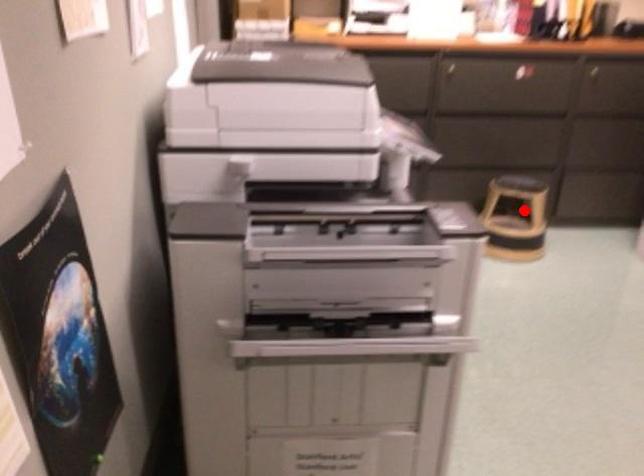
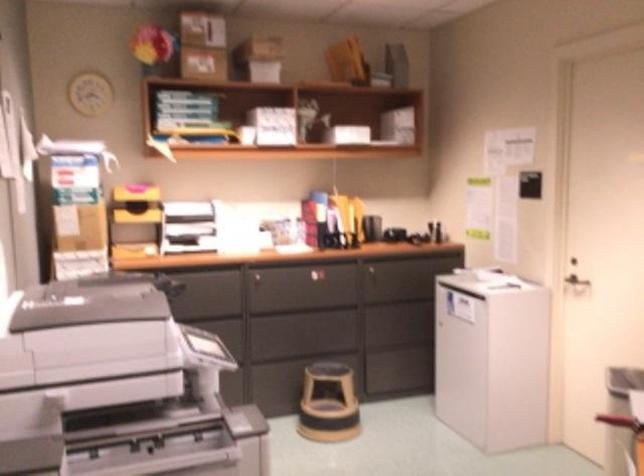
Where in the second image is the point corresponding to the highlighted location from the first image?

(328, 403)